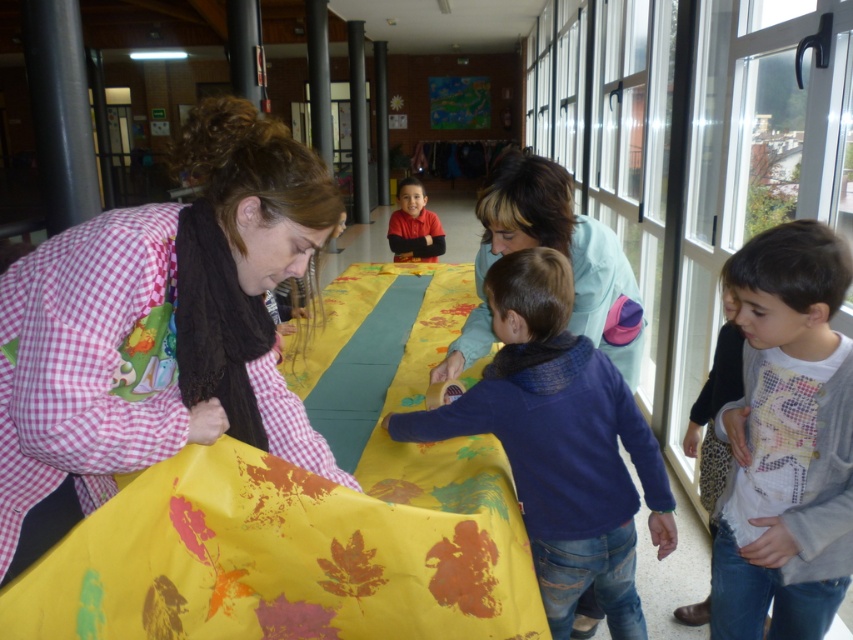
You are standing in the room and looking at the table with the yellow fabric. There are two points marked on the table surface at coordinates point (770, 276) and point (631, 381). Which point is closer to you?

Point (770, 276) is closer to the camera than point (631, 381), so the point closer to you is point (770, 276).

Looking at this image, you are standing at the entrance of the room and want to greet both the person in the white printed sweater at lower right and the person in the matte red shirt at center. If you can walk 2 meters in one minute, how many minutes will it take you to reach each of them?

The white printed sweater at lower right is 3.38 meters away from matte red shirt at center. However, the question asks for the time to reach each from the entrance, but the given distance is between the two people. Without knowing the distance from the entrance to each person, we cannot accurately calculate the time required. Please provide the distance from the entrance to each individual.

You are standing at the entrance of the room and want to reach the light blue fabric at center. There is an obstacle near the white printed sweater at lower right. Which direction should you avoid to not go near the obstacle?

The white printed sweater at lower right is to the right of the light blue fabric at center, so you should avoid going to the right to not approach the obstacle near the white printed sweater at lower right.